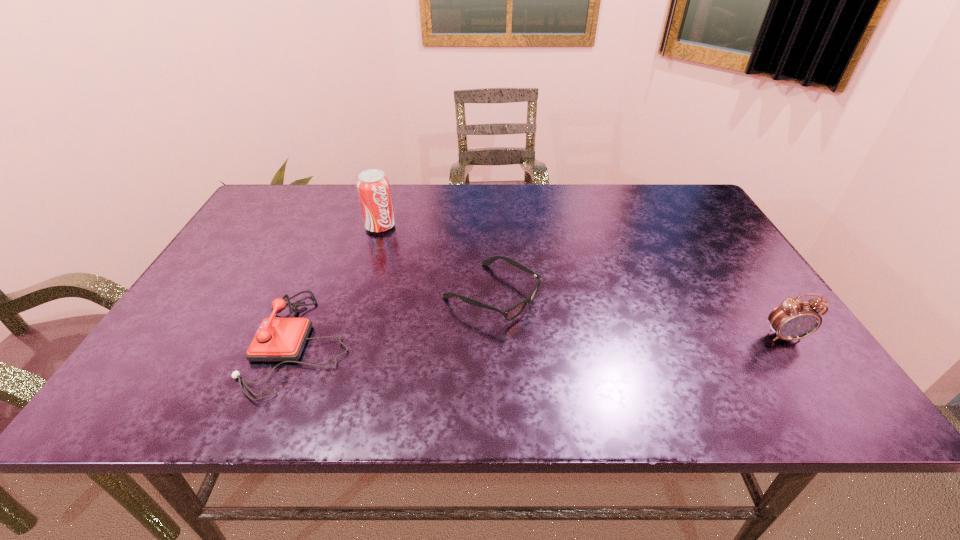
Where is `free space located 0.320m on the logo side of the soda can`? free space located 0.320m on the logo side of the soda can is located at coordinates (454, 296).

You are a GUI agent. You are given a task and a screenshot of the screen. Output one action in this format:
    pyautogui.click(x=<x>, y=<y>)
    Task: Click on the free space located on the logo side of the soda can
    The width and height of the screenshot is (960, 540).
    Given the screenshot: What is the action you would take?
    pyautogui.click(x=471, y=313)

This screenshot has height=540, width=960. I want to click on free space located 0.180m on the front-facing side of the shortest object, so click(606, 353).

Identify the location of vacant area situated on the front-facing side of the shortest object. (576, 337).

Locate an element on the screen. The image size is (960, 540). blank space located on the front-facing side of the shortest object is located at coordinates (634, 367).

Locate an element on the screen. The height and width of the screenshot is (540, 960). object that is at the far edge is located at coordinates (373, 188).

Find the location of `telephone present at the near edge`. telephone present at the near edge is located at coordinates (277, 339).

You are a GUI agent. You are given a task and a screenshot of the screen. Output one action in this format:
    pyautogui.click(x=<x>, y=<y>)
    Task: Click on the alarm clock that is at the near edge
    
    Given the screenshot: What is the action you would take?
    pyautogui.click(x=794, y=319)

Where is `object located in the right edge section of the desktop`? This screenshot has height=540, width=960. object located in the right edge section of the desktop is located at coordinates (794, 319).

Find the location of `object that is at the near right corner`. object that is at the near right corner is located at coordinates (794, 319).